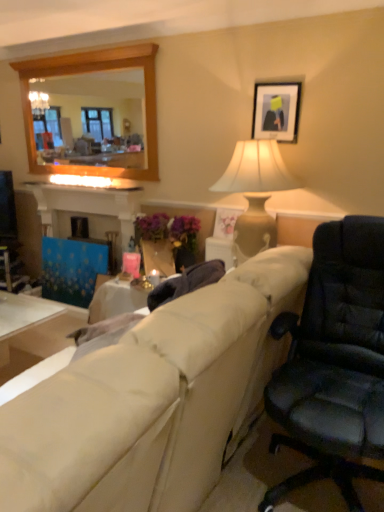
Question: Considering the positions of matte black picture frame at upper center and wooden frame mirror at upper left in the image, is matte black picture frame at upper center bigger or smaller than wooden frame mirror at upper left?

Choices:
 (A) small
 (B) big

Answer: (A)

Question: Is matte black picture frame at upper center to the left or to the right of wooden frame mirror at upper left in the image?

Choices:
 (A) left
 (B) right

Answer: (B)

Question: Which object is the farthest from the white glossy table at lower left?

Choices:
 (A) matte beige vase at center
 (B) matte black picture frame at upper center
 (C) wooden frame mirror at upper left
 (D) beige fabric couch at center

Answer: (C)

Question: Based on their relative distances, which object is farther from the matte black picture frame at upper center?

Choices:
 (A) wooden frame mirror at upper left
 (B) matte beige vase at center
 (C) white glossy table at lower left
 (D) beige fabric couch at center

Answer: (A)